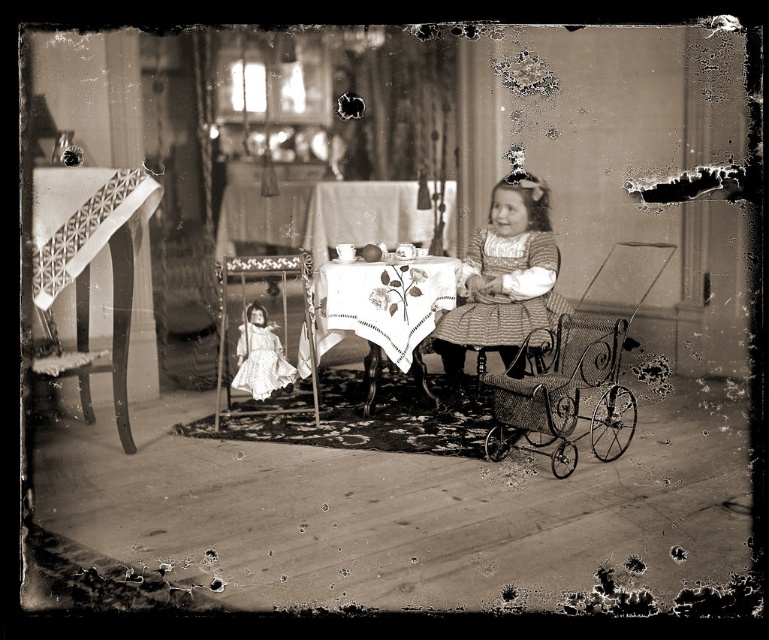
You are a guest in this vintage living room and notice two items at the center of the rug. One is the striped fabric dress at center and the other is the white satin doll at center. Which one is positioned more to the right?

The striped fabric dress at center is to the right of the white satin doll at center, so the striped fabric dress at center is positioned more to the right.

You are a photographer trying to capture the striped fabric dress at center and the matte wooden chair at center in a single frame. Based on their heights, which object will appear larger in the photo?

The striped fabric dress at center will appear larger in the photo since it is much taller than the matte wooden chair at center.